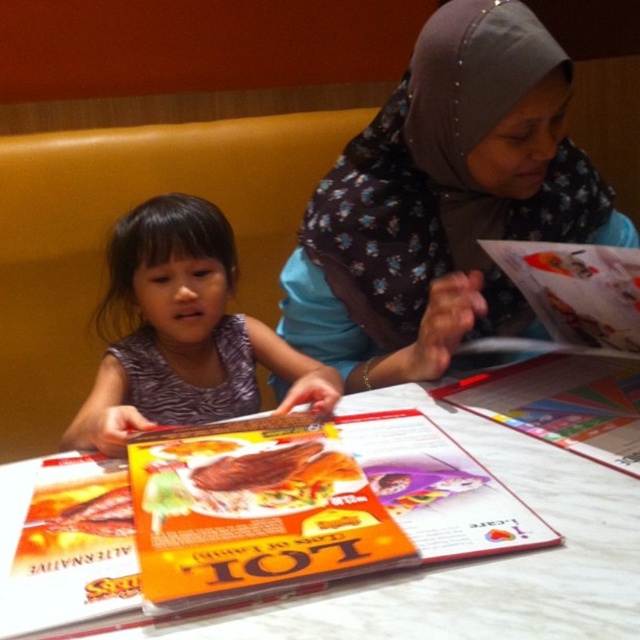
Question: Can you confirm if floral-patterned hijab at upper right is positioned above white glossy table at center?

Choices:
 (A) no
 (B) yes

Answer: (B)

Question: Which point appears farthest from the camera in this image?

Choices:
 (A) (545, 342)
 (B) (444, 490)
 (C) (426, 97)

Answer: (A)

Question: Is purple fabric dress at center closer to camera compared to orange glossy menu at center?

Choices:
 (A) no
 (B) yes

Answer: (A)

Question: Which of these objects is positioned closest to the white glossy table at center?

Choices:
 (A) purple fabric dress at center
 (B) orange glossy menu at center

Answer: (B)

Question: Estimate the real-world distances between objects in this image. Which object is closer to the orange glossy menu at center?

Choices:
 (A) white glossy table at center
 (B) floral-patterned hijab at upper right
 (C) purple fabric dress at center

Answer: (B)

Question: Is white glossy table at center bigger than orange glossy menu at center?

Choices:
 (A) no
 (B) yes

Answer: (B)